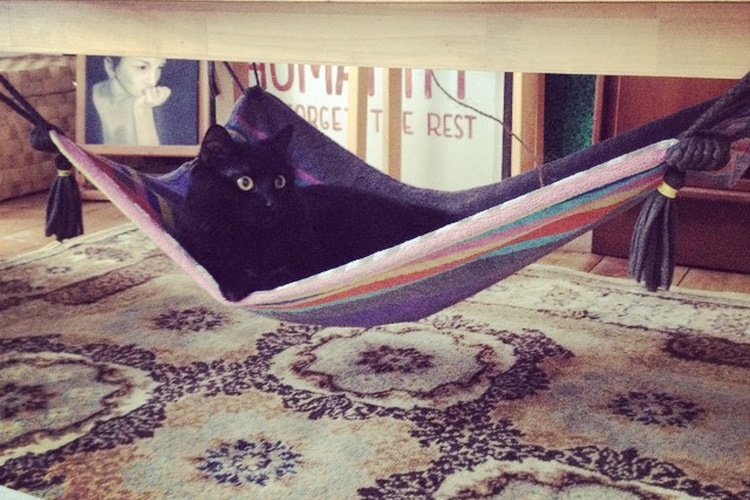
You are a GUI agent. You are given a task and a screenshot of the screen. Output one action in this format:
    pyautogui.click(x=<x>, y=<y>)
    Task: Click on the rug
    
    Given the screenshot: What is the action you would take?
    pyautogui.click(x=79, y=339)